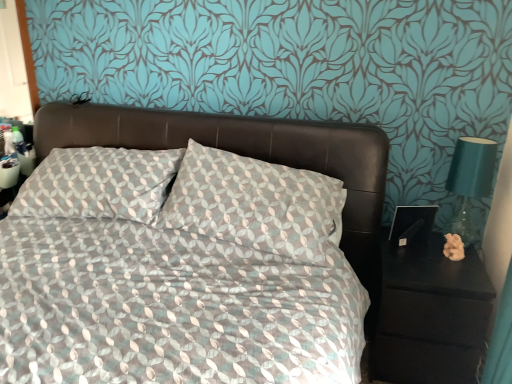
This screenshot has height=384, width=512. I want to click on free space in front of teal glass lamp at right, so click(458, 271).